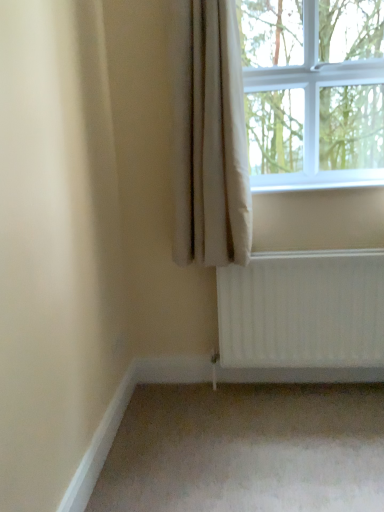
Question: Is clear glass window at upper right inside the boundaries of beige fabric curtain at upper right, or outside?

Choices:
 (A) outside
 (B) inside

Answer: (A)

Question: From the image's perspective, is clear glass window at upper right positioned above or below beige fabric curtain at upper right?

Choices:
 (A) above
 (B) below

Answer: (A)

Question: Considering the positions of clear glass window at upper right and beige fabric curtain at upper right in the image, is clear glass window at upper right wider or thinner than beige fabric curtain at upper right?

Choices:
 (A) thin
 (B) wide

Answer: (B)

Question: In the image, is beige fabric curtain at upper right positioned in front of or behind clear glass window at upper right?

Choices:
 (A) front
 (B) behind

Answer: (A)

Question: Is point (205, 47) positioned closer to the camera than point (322, 145)?

Choices:
 (A) farther
 (B) closer

Answer: (B)

Question: Based on their sizes in the image, would you say beige fabric curtain at upper right is bigger or smaller than clear glass window at upper right?

Choices:
 (A) small
 (B) big

Answer: (A)

Question: From the image's perspective, is beige fabric curtain at upper right positioned above or below clear glass window at upper right?

Choices:
 (A) above
 (B) below

Answer: (B)